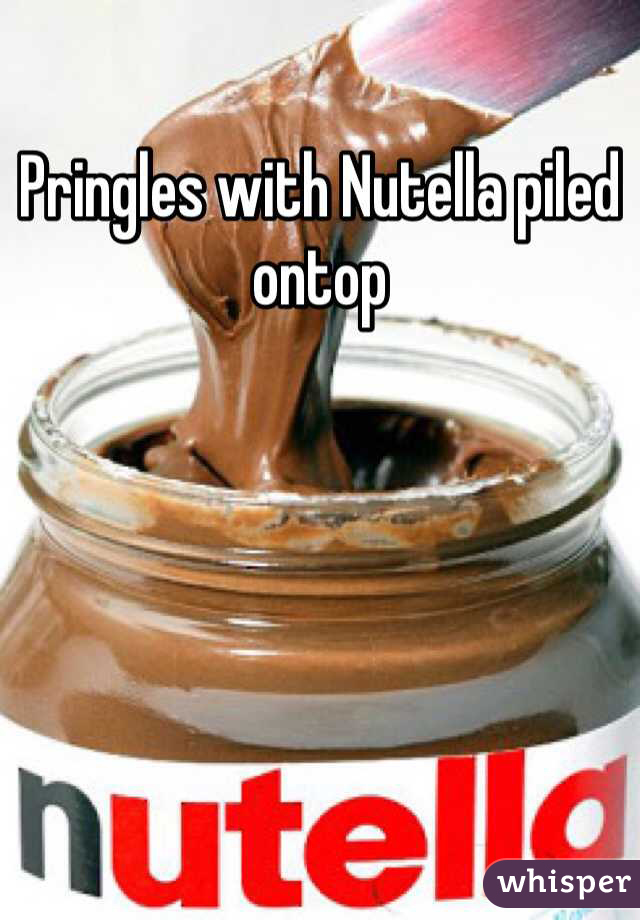
Identify the location of butter knife. This screenshot has width=640, height=920. (490, 47).